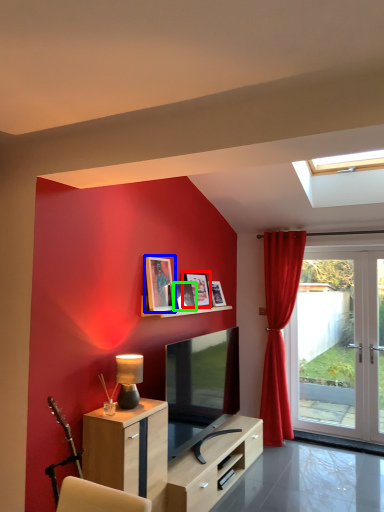
Question: Estimate the real-world distances between objects in this image. Which object is closer to picture frame (highlighted by a red box), picture frame (highlighted by a blue box) or picture frame (highlighted by a green box)?

Choices:
 (A) picture frame
 (B) picture frame

Answer: (B)